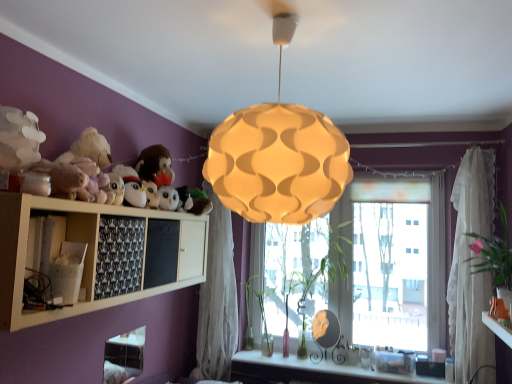
Question: Is green glass vase at window, the 1th plant viewed from the back, wider or thinner than white glossy vanity at lower center?

Choices:
 (A) wide
 (B) thin

Answer: (B)

Question: Is green glass vase at window, which is counted as the fourth plant, starting from the front, bigger or smaller than white glossy vanity at lower center?

Choices:
 (A) small
 (B) big

Answer: (B)

Question: Considering the real-world distances, which object is closest to the white lace curtain at right, acting as the second curtain starting from the left?

Choices:
 (A) green matte plant at center, which appears as the 2th plant when viewed from the right
 (B) fluffy white stuffed animal at upper left, positioned as the first toy in top-to-bottom order
 (C) black fabric at lower left, the second shelf when ordered from left to right
 (D) white plush toy at upper center, the 1th toy from the back
 (E) green glass vase at window, which is the first plant from left to right

Answer: (A)

Question: Which of these objects is positioned closest to the green glass vase at window, which appears as the 3th plant when viewed from the front?

Choices:
 (A) matte yellow pendant light at center
 (B) matte white table at lower right
 (C) white glossy vanity at lower center
 (D) green leafy plant at right, which is the 4th plant in left-to-right order
 (E) white sheer curtain at center, arranged as the first curtain when viewed from the left

Answer: (C)